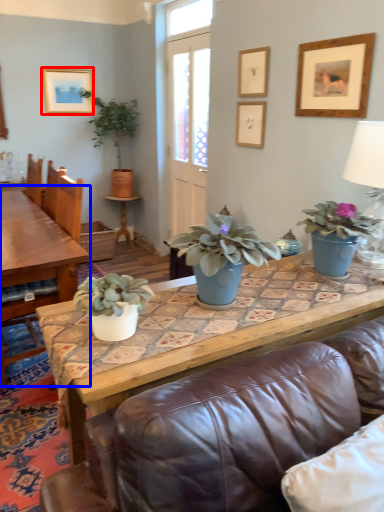
Question: Which object appears closest to the camera in this image, picture frame (highlighted by a red box) or coffee table (highlighted by a blue box)?

Choices:
 (A) picture frame
 (B) coffee table

Answer: (B)